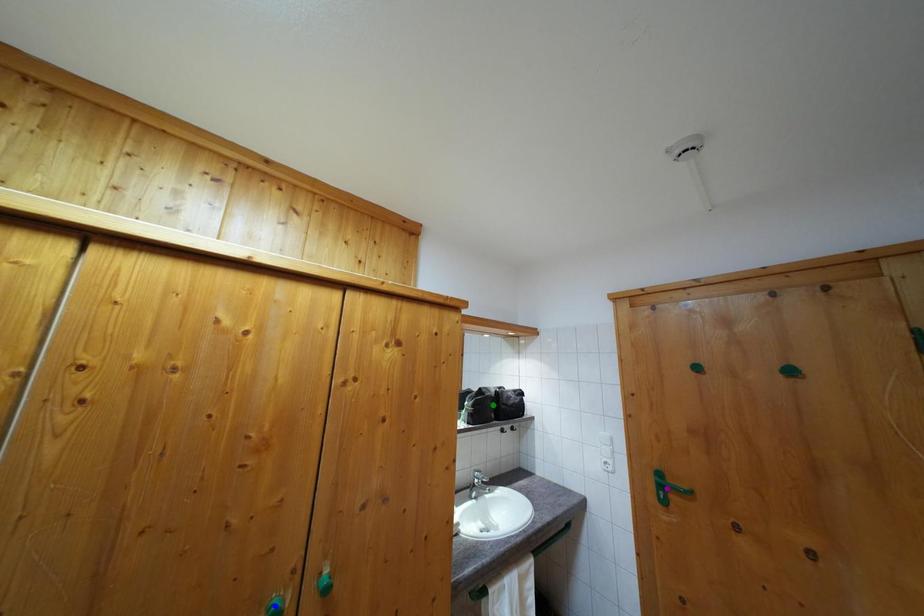
Order these from nearest to farthest:
1. green point
2. purple point
3. blue point

blue point
purple point
green point